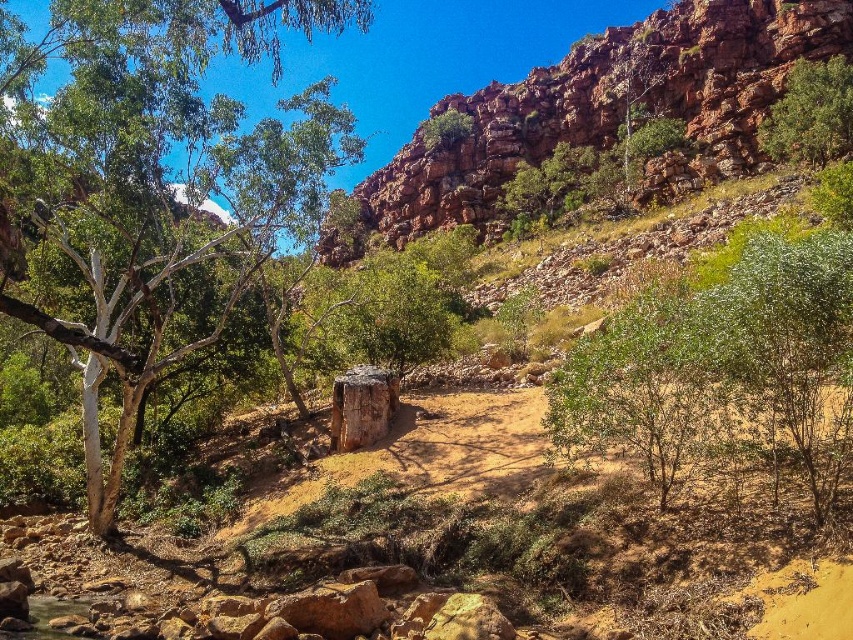
You are a hiker trying to navigate between the two green leafy trees. Which tree has a wider spread of branches? Please choose between the green leafy tree at left and the green leafy tree at upper center.

The green leafy tree at left has a wider spread of branches compared to the green leafy tree at upper center.

You are a hiker planning to climb the rusty rock cliff at upper right and also want to rest under the green leafy tree at upper right. Which object is higher in elevation?

The rusty rock cliff at upper right is above the green leafy tree at upper right, so it is higher in elevation.